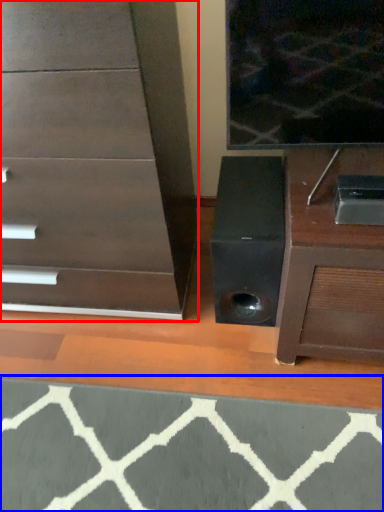
Question: Which point is further to the camera, chest of drawers (highlighted by a red box) or doormat (highlighted by a blue box)?

Choices:
 (A) chest of drawers
 (B) doormat

Answer: (B)